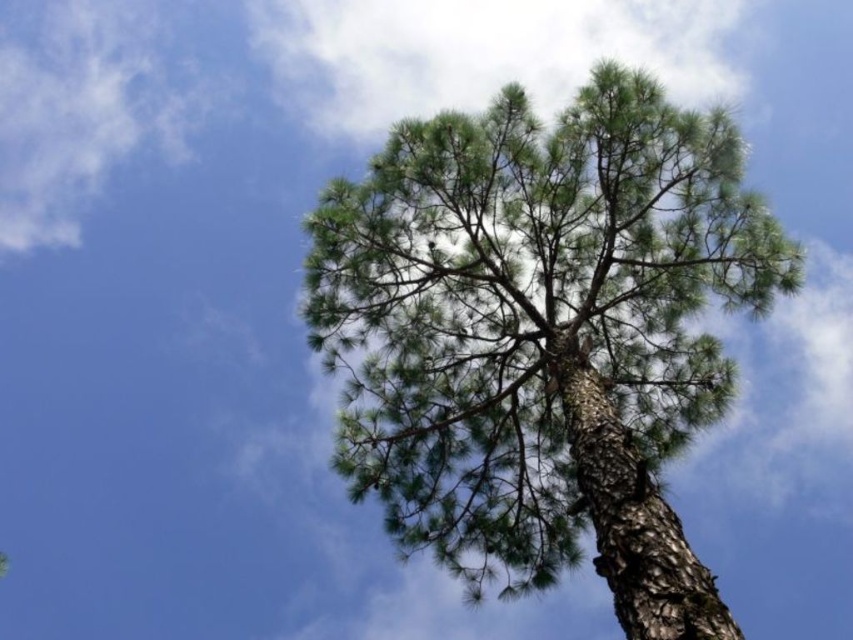
Does green rough bark tree at center appear over white fluffy cloud at upper center?

No.

Can you confirm if green rough bark tree at center is shorter than white fluffy cloud at upper center?

Yes.

Which is in front, point (531, 211) or point (503, 49)?

Point (531, 211)

Locate an element on the screen. The width and height of the screenshot is (853, 640). green rough bark tree at center is located at coordinates (543, 333).